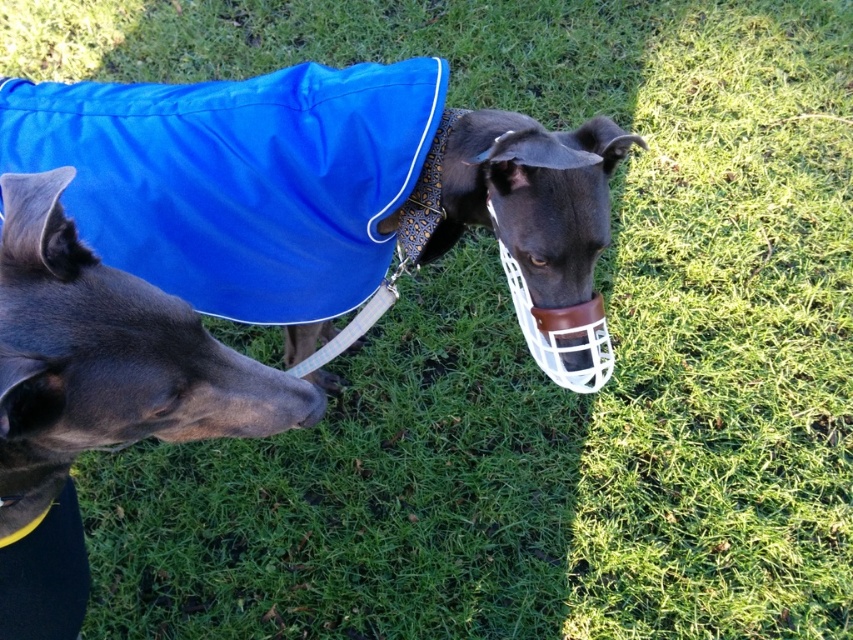
You are a dog owner trying to choose between two coats for your greyhound. The shiny blue coat at center and the shiny black coat at center are both available. Based on the image, which coat would you recommend if you need one that is wider?

The shiny blue coat at center might be wider than shiny black coat at center, so I would recommend the shiny blue coat at center for its wider design.

Where is the shiny blue coat at center located in the image?

The shiny blue coat at center is located at point (328, 196) in the image.